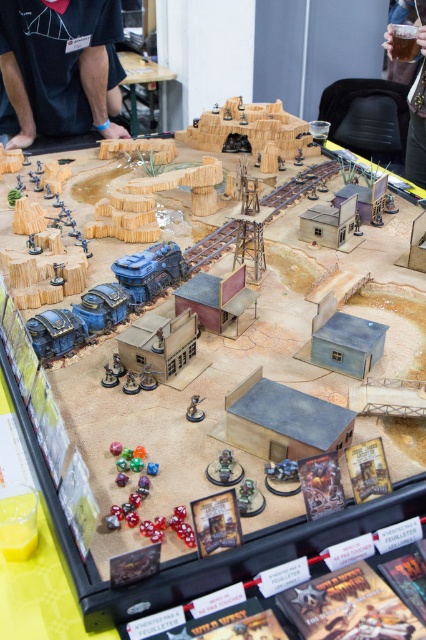
You are a game piece that is 0.5 meters wide. You are standing at the translucent plastic cup at upper right and want to move to the wooden table at upper center. Is there enough space for you to move directly between them without any obstacles?

The distance between the translucent plastic cup at upper right and the wooden table at upper center is 2.17 meters. Since the game piece is only 0.5 meters wide, there is sufficient space for it to move directly between them without any obstacles.